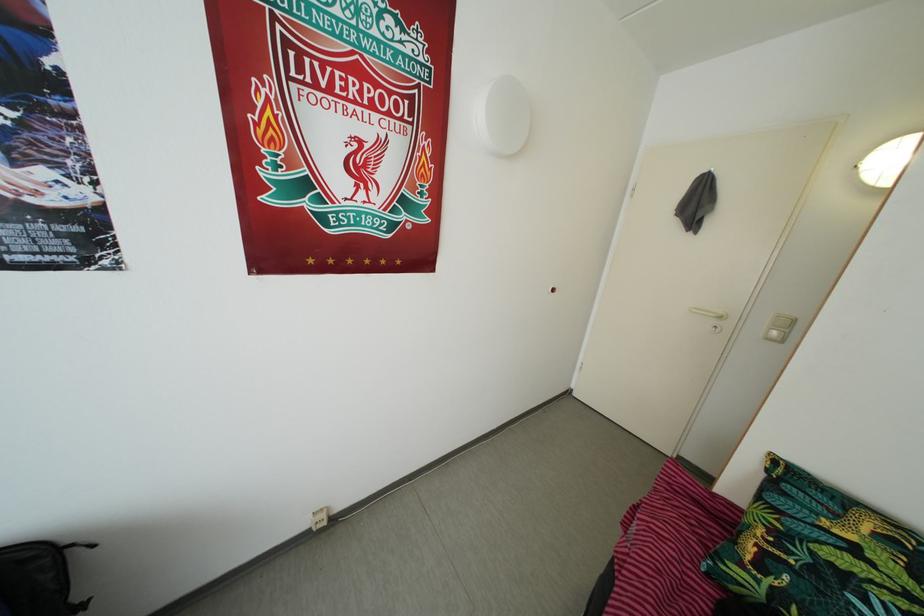
This screenshot has height=616, width=924. Identify the location of patterned green pillow. (819, 552).